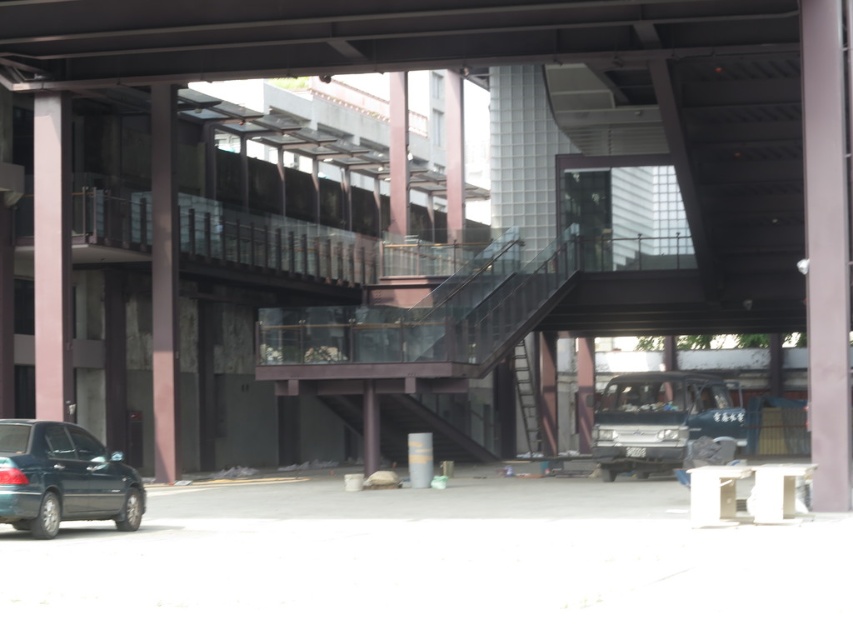
Question: Is dark blue matte van at center in front of metallic staircase at center?

Choices:
 (A) yes
 (B) no

Answer: (A)

Question: Which of these objects is positioned farthest from the dark blue matte van at center?

Choices:
 (A) pink matte pillar at left
 (B) metallic staircase at center
 (C) shiny dark blue sedan at lower left

Answer: (C)

Question: Which point is closer to the camera taking this photo?

Choices:
 (A) (386, 419)
 (B) (169, 83)
 (C) (36, 452)
 (D) (669, 397)

Answer: (C)

Question: Observing the image, what is the correct spatial positioning of pink matte pillar at left in reference to metallic staircase at center?

Choices:
 (A) left
 (B) right

Answer: (A)

Question: Which is nearer to the pink matte pillar at left?

Choices:
 (A) shiny dark blue sedan at lower left
 (B) dark blue matte van at center
 (C) metallic staircase at center

Answer: (C)

Question: Is shiny dark blue sedan at lower left bigger than dark blue matte van at center?

Choices:
 (A) yes
 (B) no

Answer: (B)